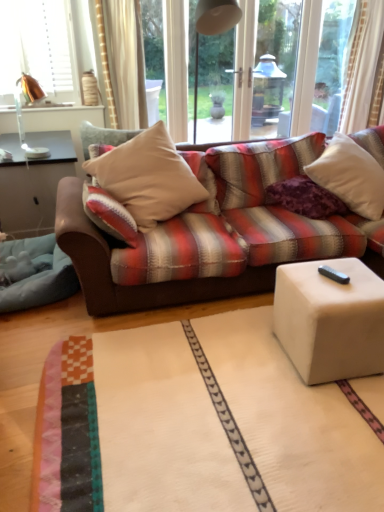
Question: Considering the relative sizes of white soft cushion at upper right, arranged as the first pillow when viewed from the right, and blue soft fabric at lower left in the image provided, is white soft cushion at upper right, arranged as the first pillow when viewed from the right, shorter than blue soft fabric at lower left?

Choices:
 (A) no
 (B) yes

Answer: (A)

Question: Are white soft cushion at upper right, arranged as the first pillow when viewed from the right, and blue soft fabric at lower left far apart?

Choices:
 (A) no
 (B) yes

Answer: (B)

Question: Is white soft cushion at upper right, the 3th pillow positioned from the left, surrounding blue soft fabric at lower left?

Choices:
 (A) yes
 (B) no

Answer: (B)

Question: From the image's perspective, is white soft cushion at upper right, the 3th pillow positioned from the left, under blue soft fabric at lower left?

Choices:
 (A) yes
 (B) no

Answer: (B)

Question: Is white soft cushion at upper right, the 3th pillow positioned from the left, closer to camera compared to blue soft fabric at lower left?

Choices:
 (A) yes
 (B) no

Answer: (B)

Question: Can you confirm if white soft cushion at upper right, arranged as the first pillow when viewed from the right, is positioned to the left of blue soft fabric at lower left?

Choices:
 (A) yes
 (B) no

Answer: (B)

Question: Can copper metallic table lamp at upper left be found inside purple velvet pillow at center, marked as the second pillow in a left-to-right arrangement?

Choices:
 (A) no
 (B) yes

Answer: (A)

Question: Is purple velvet pillow at center, the 2th pillow from the right, aimed at copper metallic table lamp at upper left?

Choices:
 (A) no
 (B) yes

Answer: (A)

Question: From a real-world perspective, is purple velvet pillow at center, marked as the second pillow in a left-to-right arrangement, positioned under copper metallic table lamp at upper left based on gravity?

Choices:
 (A) no
 (B) yes

Answer: (B)

Question: Does purple velvet pillow at center, the 2th pillow from the right, have a greater height compared to copper metallic table lamp at upper left?

Choices:
 (A) no
 (B) yes

Answer: (A)

Question: Does purple velvet pillow at center, the 2th pillow from the right, have a lesser width compared to copper metallic table lamp at upper left?

Choices:
 (A) yes
 (B) no

Answer: (B)

Question: Is purple velvet pillow at center, marked as the second pillow in a left-to-right arrangement, placed right next to copper metallic table lamp at upper left?

Choices:
 (A) yes
 (B) no

Answer: (B)

Question: Are copper metallic table lamp at upper left and purple velvet pillow at center, the 2th pillow from the right, making contact?

Choices:
 (A) no
 (B) yes

Answer: (A)